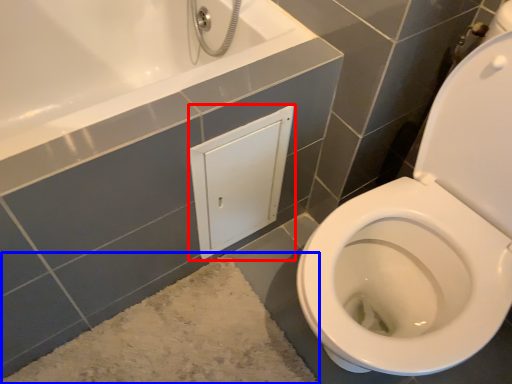
Question: Which point is closer to the camera, medicine cabinet (highlighted by a red box) or bath mat (highlighted by a blue box)?

Choices:
 (A) medicine cabinet
 (B) bath mat

Answer: (B)